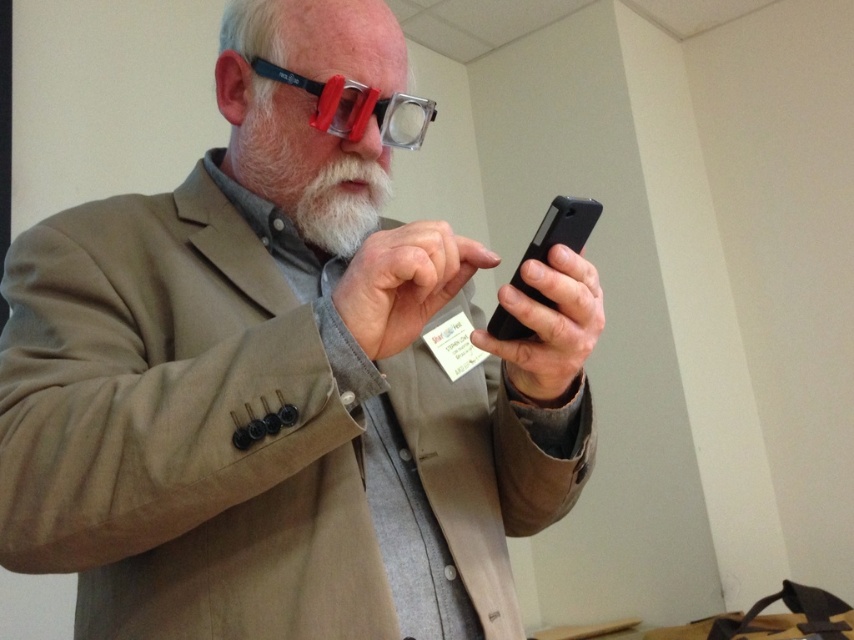
Based on the scene description, where is the white matte beard at center positioned in relation to the man?

The white matte beard at center is located at point coordinates 0.273 on the x axis and 0.361 on the y axis.

You are designing a display stand that needs to accommodate both the matte black phone at center and the white matte paper at center. Given the spatial relationship between them, which object requires a wider slot in the stand?

The matte black phone at center requires a wider slot in the stand because its width surpasses that of the white matte paper at center.

You are a delivery person who needs to place a matte black phone at center and a white matte paper at center on a small shelf that can only hold items up to 12 inches in length. Which item should you place first to ensure both fit?

The matte black phone at center is bigger than the white matte paper at center, so you should place the matte black phone at center first to ensure both items fit on the shelf.